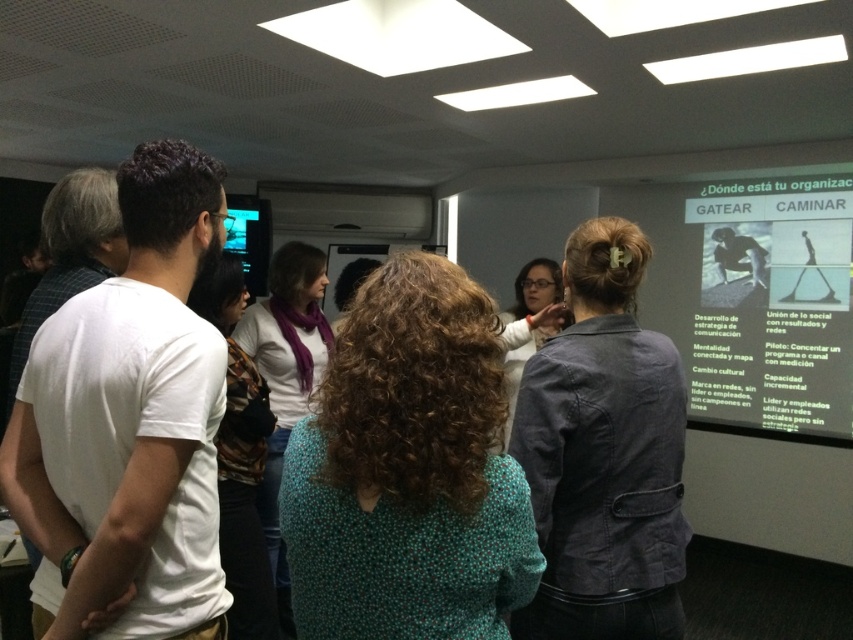
You are a photographer positioned at the entrance of the conference room. You want to capture a photo that includes both the dark gray denim jacket at center and the matte black screen at upper left. Considering their sizes, which object should you frame first to ensure both fit in the shot?

The dark gray denim jacket at center is wider than the matte black screen at upper left, so you should frame the dark gray denim jacket at center first to ensure both fit in the shot.

You are standing in the conference room and notice the dark gray denim jacket at center and the matte black screen at upper left. Which object is located lower in the room?

The dark gray denim jacket at center is positioned under the matte black screen at upper left, so it is located lower in the room.